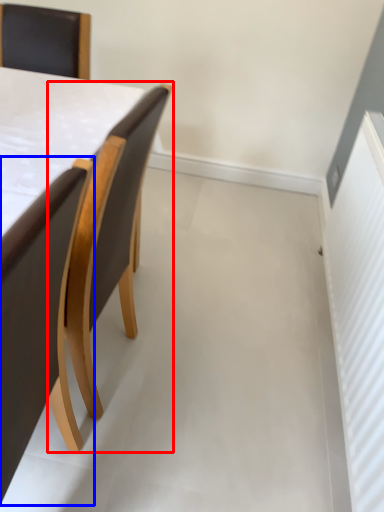
Question: Which point is closer to the camera, chair (highlighted by a red box) or chair (highlighted by a blue box)?

Choices:
 (A) chair
 (B) chair

Answer: (B)